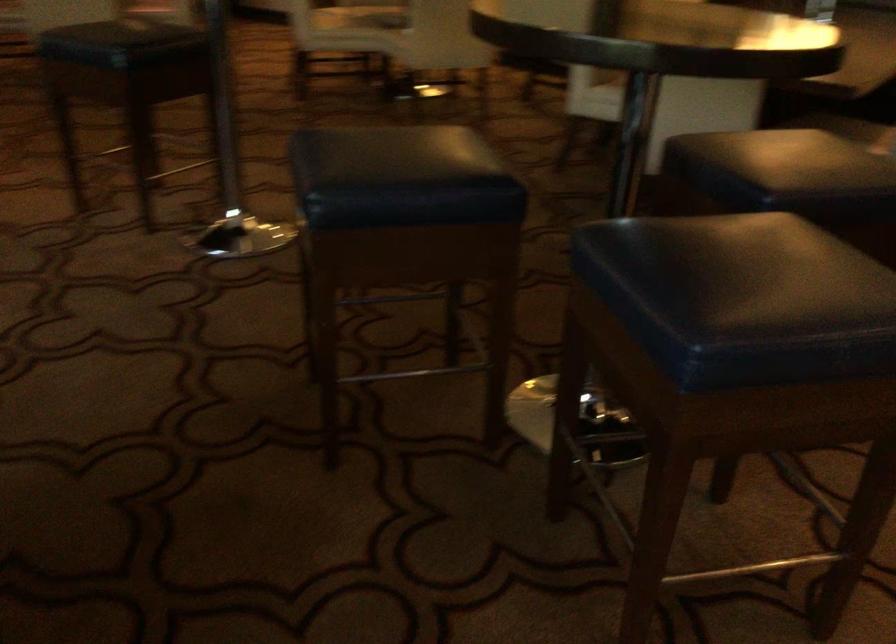
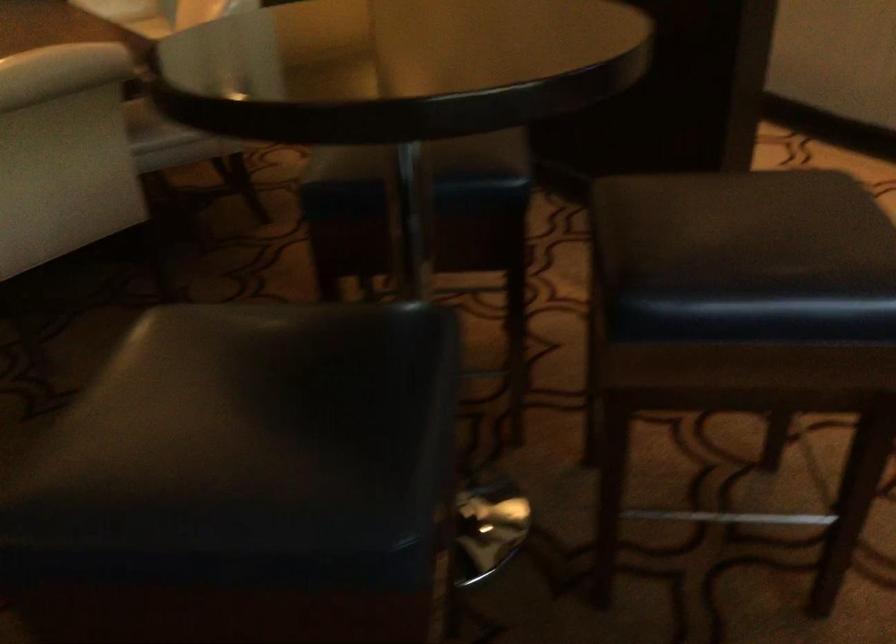
In the second image, find the point that corresponds to the point at 324,151 in the first image.

(247, 436)